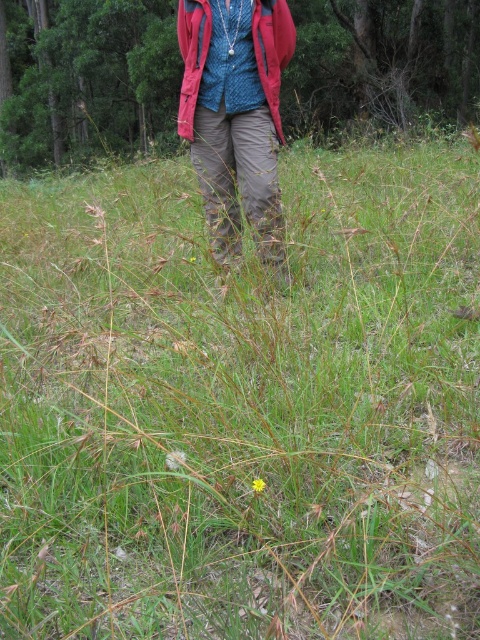
Is knitted blue sweater at center to the left of khaki pants at center from the viewer's perspective?

No, knitted blue sweater at center is not to the left of khaki pants at center.

This screenshot has width=480, height=640. I want to click on knitted blue sweater at center, so click(x=236, y=115).

What are the coordinates of `knitted blue sweater at center` in the screenshot? It's located at (236, 115).

Which is in front, point (462, 35) or point (206, 176)?

Point (206, 176)

Does point (431, 61) come in front of point (237, 250)?

No, (431, 61) is behind (237, 250).

Locate an element on the screen. The height and width of the screenshot is (640, 480). green grass at center is located at coordinates (86, 77).

Between point (37, 4) and point (278, 56), which one is positioned in front?

Point (278, 56)

From the picture: Between green grass at center and red fleece jacket at center, which one is positioned lower?

red fleece jacket at center is lower down.

Who is more forward, (40, 8) or (283, 58)?

Point (283, 58) is in front.

You are a GUI agent. You are given a task and a screenshot of the screen. Output one action in this format:
    pyautogui.click(x=<x>, y=<y>)
    Task: Click on the green grass at center
    
    Given the screenshot: What is the action you would take?
    pyautogui.click(x=86, y=77)